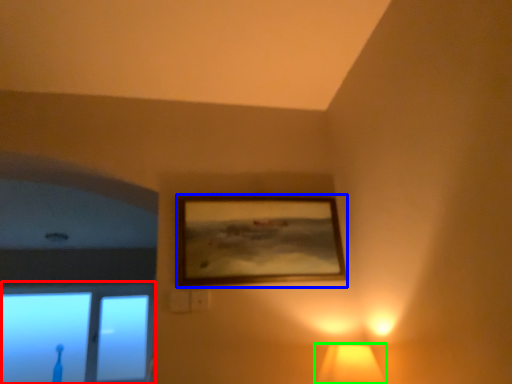
Question: Based on their relative distances, which object is nearer to window (highlighted by a red box)? Choose from picture frame (highlighted by a blue box) and lamp (highlighted by a green box).

Choices:
 (A) picture frame
 (B) lamp

Answer: (A)